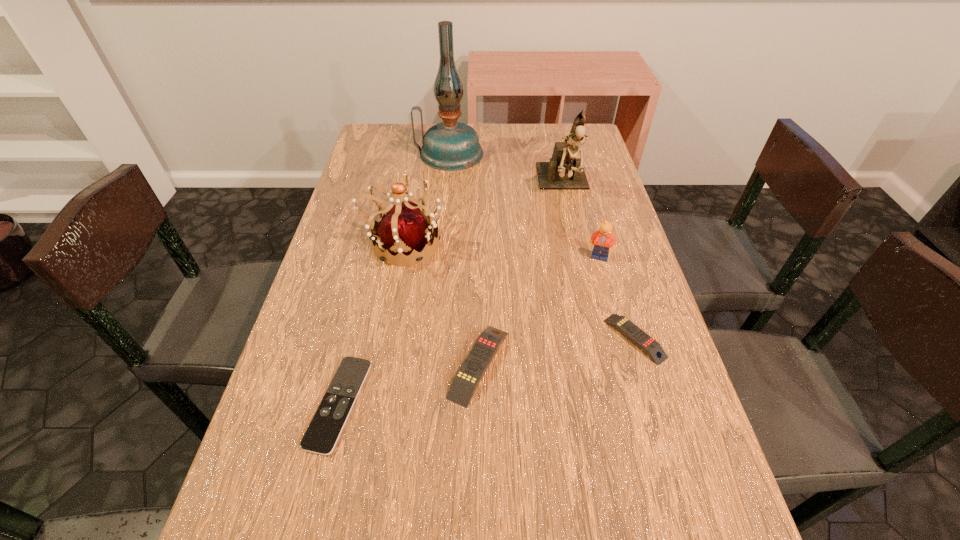
I want to click on unoccupied position between the Lego and the third tallest object, so click(501, 251).

I want to click on empty location between the third tallest object and the Lego, so click(501, 251).

Find the location of a particular element. The image size is (960, 540). free space between the tiara and the Lego is located at coordinates (501, 251).

Where is `free point between the orange Lego and the fifth shortest object`? free point between the orange Lego and the fifth shortest object is located at coordinates (501, 251).

Where is `free space between the leftmost remote control and the Lego`? free space between the leftmost remote control and the Lego is located at coordinates (469, 330).

In order to click on empty location between the second shortest object and the black remote control in this screenshot , I will do `click(487, 371)`.

What are the coordinates of `free spot between the second shortest object and the Lego` in the screenshot? It's located at (617, 298).

You are a GUI agent. You are given a task and a screenshot of the screen. Output one action in this format:
    pyautogui.click(x=<x>, y=<y>)
    Task: Click on the vacant space that is in between the leftmost remote control and the fourth tallest object
    Image resolution: width=960 pixels, height=540 pixels.
    Given the screenshot: What is the action you would take?
    pyautogui.click(x=469, y=330)

This screenshot has height=540, width=960. What are the coordinates of `object that is the fourth closest to the sixth tallest object` in the screenshot? It's located at (564, 171).

Select which object appears as the sixth closest to the orange Lego. Please provide its 2D coordinates. Your answer should be formatted as a tuple, i.e. [(x, y)], where the tuple contains the x and y coordinates of a point satisfying the conditions above.

[(328, 422)]